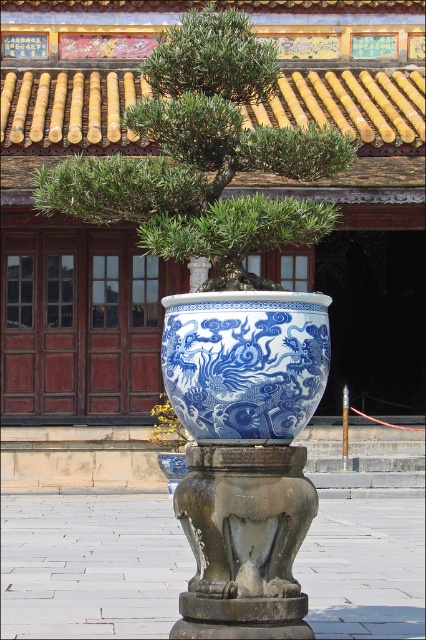
You are a gardener standing in the courtyard and want to water both the green leafy tree at center and the blue porcelain vase at center. If your watering can has a range of 5 feet, can you water both objects without moving closer?

The green leafy tree at center is 5.51 feet away from the blue porcelain vase at center. Since the distance between them exceeds the watering can range of 5 feet, you cannot water both objects without moving closer.

Looking at this image, you are standing in the traditional Chinese garden and want to place a decorative stone exactly halfway between the green leafy tree at center and the edge of the bonsai pot. Where should you place the stone?

The green leafy tree at center is located at point (204, 156). To place the decorative stone halfway between the tree and the edge of the bonsai pot, you would need to calculate the midpoint between these two coordinates. However, the exact position of the bonsai pot edge isn not provided in the description. Please provide the coordinates of the pot edge to determine the exact placement.

You are standing in a traditional Chinese garden and notice a point marked at coordinates [204,156]. What object is located at this point?

The green leafy tree at center is located at point [204,156].